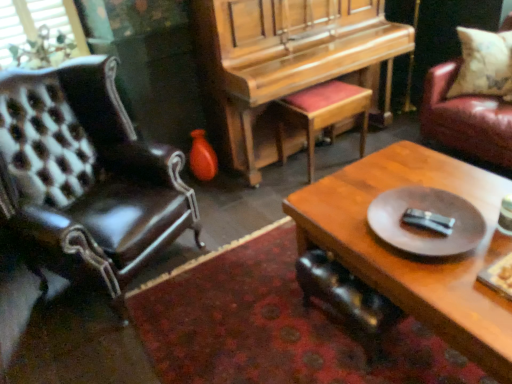
At what (x,y) coordinates should I click in order to perform the action: click on empty space that is ontop of velvet red stool at center (from a real-world perspective). Please return your answer as a coordinate pair (x, y). Looking at the image, I should click on (330, 96).